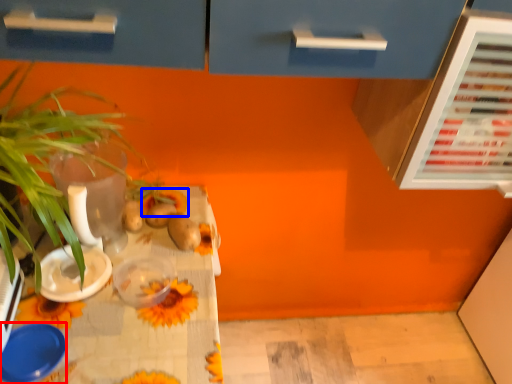
Question: Which object appears closest to the camera in this image, tableware (highlighted by a red box) or flower (highlighted by a blue box)?

Choices:
 (A) tableware
 (B) flower

Answer: (A)